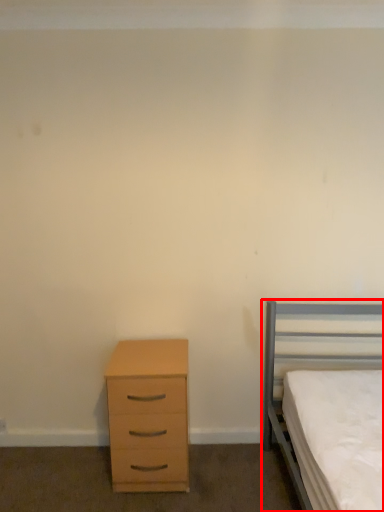
Question: From the image's perspective, what is the correct spatial relationship of bed (annotated by the red box) in relation to chest of drawers?

Choices:
 (A) above
 (B) below

Answer: (A)